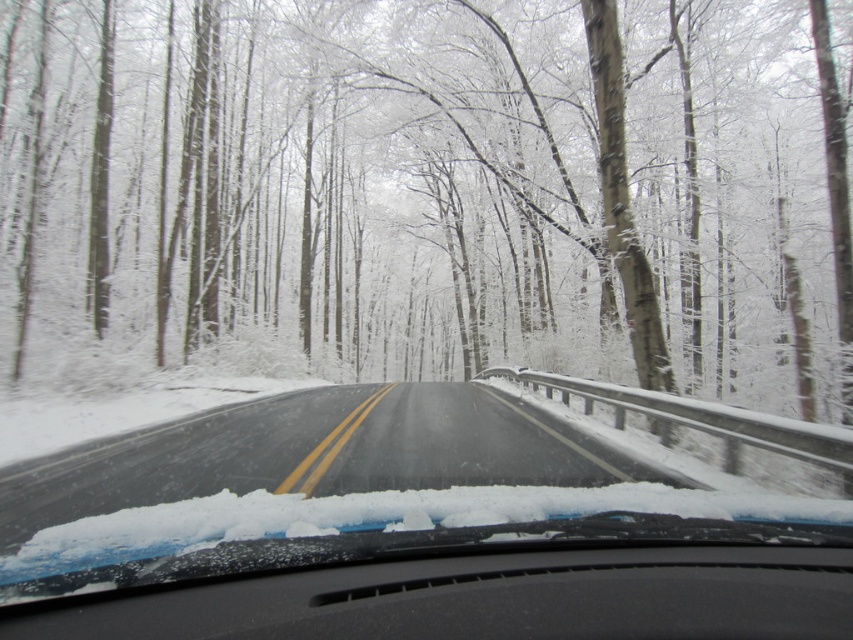
Question: Which point is farther to the camera?

Choices:
 (A) black rubber windshield wiper at center
 (B) snow-covered trees at center

Answer: (B)

Question: Based on their relative distances, which object is nearer to the black rubber windshield wiper at center?

Choices:
 (A) snow-covered trees at center
 (B) black matte dashboard at center

Answer: (B)

Question: Considering the relative positions of snow-covered trees at center and black rubber windshield wiper at center in the image provided, where is snow-covered trees at center located with respect to black rubber windshield wiper at center?

Choices:
 (A) right
 (B) left

Answer: (A)

Question: Considering the relative positions of snow-covered trees at center and black rubber windshield wiper at center in the image provided, where is snow-covered trees at center located with respect to black rubber windshield wiper at center?

Choices:
 (A) below
 (B) above

Answer: (B)

Question: Which is nearer to the black matte dashboard at center?

Choices:
 (A) snow-covered trees at center
 (B) black rubber windshield wiper at center

Answer: (B)

Question: Where is snow-covered trees at center located in relation to black rubber windshield wiper at center in the image?

Choices:
 (A) below
 (B) above

Answer: (B)